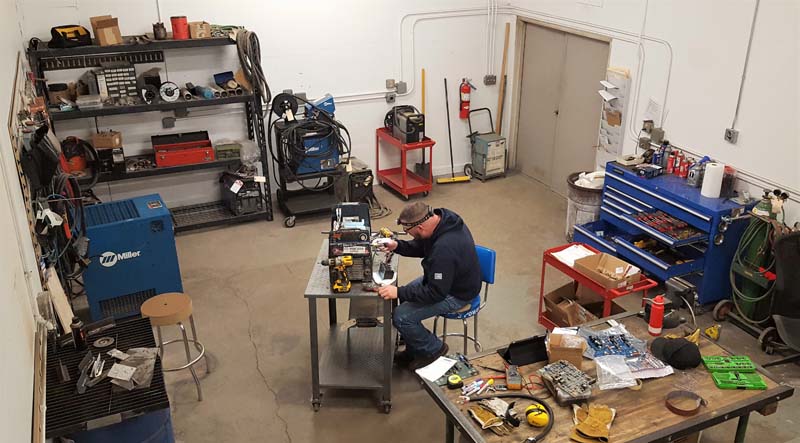
The width and height of the screenshot is (800, 443). Identify the location of fire extinguisher. (462, 97).